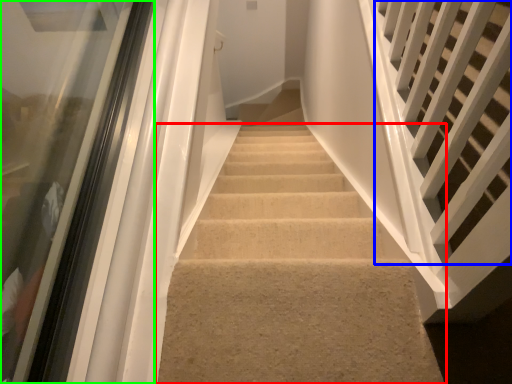
Question: Which is nearer to the stairs (highlighted by a red box)? stairs (highlighted by a blue box) or glass door (highlighted by a green box).

Choices:
 (A) stairs
 (B) glass door

Answer: (A)